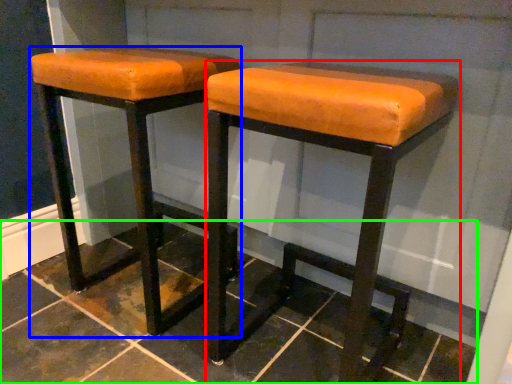
Question: Which is farther away from stool (highlighted by a red box)? stool (highlighted by a blue box) or tile (highlighted by a green box)?

Choices:
 (A) stool
 (B) tile

Answer: (B)